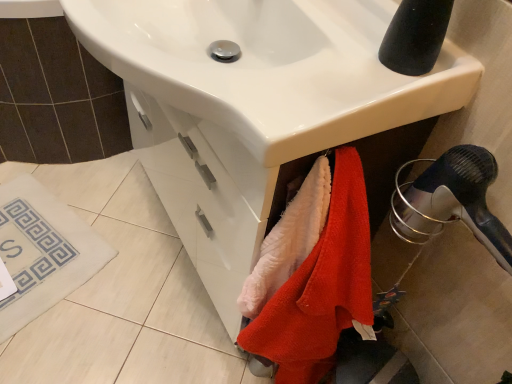
What do you see at coordinates (42, 252) in the screenshot?
I see `white fabric bath mat at lower left` at bounding box center [42, 252].

The width and height of the screenshot is (512, 384). What are the coordinates of `white glossy sink at center` in the screenshot? It's located at (272, 68).

What do you see at coordinates (323, 285) in the screenshot? I see `fluffy orange towel at lower right, which is the 2th beach towel from top to bottom` at bounding box center [323, 285].

Locate an element on the screen. This screenshot has height=384, width=512. fluffy pink towel at lower center, acting as the second beach towel starting from the bottom is located at coordinates (289, 240).

The image size is (512, 384). I want to click on white fabric bath mat at lower left, so click(x=42, y=252).

Is fluffy orange towel at lower right, which is the 2th beach towel from top to bottom, aimed at white glossy sink at center?

No, fluffy orange towel at lower right, which is the 2th beach towel from top to bottom, is not aimed at white glossy sink at center.

In the scene shown: Is fluffy orange towel at lower right, which is the 2th beach towel from top to bottom, in contact with white glossy sink at center?

They are not placed beside each other.

Which object is further away from the camera, fluffy orange towel at lower right, which is the 1th beach towel in bottom-to-top order, or white glossy sink at center?

fluffy orange towel at lower right, which is the 1th beach towel in bottom-to-top order, is behind.

Between fluffy orange towel at lower right, which is the 2th beach towel from top to bottom, and white glossy sink at center, which one has less height?

With less height is white glossy sink at center.

Which point is more forward, (354, 8) or (300, 241)?

The point (300, 241) is more forward.

Is white glossy sink at center looking in the opposite direction of fluffy pink towel at lower center, which is the first beach towel in top-to-bottom order?

No.

How much distance is there between white glossy sink at center and fluffy pink towel at lower center, which is the first beach towel in top-to-bottom order?

white glossy sink at center and fluffy pink towel at lower center, which is the first beach towel in top-to-bottom order, are 10.71 inches apart.

From a real-world perspective, is white glossy sink at center physically located above or below fluffy pink towel at lower center, which is the first beach towel in top-to-bottom order?

white glossy sink at center is situated higher than fluffy pink towel at lower center, which is the first beach towel in top-to-bottom order, in the real world.

Considering the relative positions of fluffy orange towel at lower right, which is the 1th beach towel in bottom-to-top order, and white fabric bath mat at lower left in the image provided, is fluffy orange towel at lower right, which is the 1th beach towel in bottom-to-top order, to the left of white fabric bath mat at lower left from the viewer's perspective?

No.

Who is smaller, fluffy orange towel at lower right, which is the 2th beach towel from top to bottom, or white fabric bath mat at lower left?

With smaller size is fluffy orange towel at lower right, which is the 2th beach towel from top to bottom.

How different are the orientations of fluffy orange towel at lower right, which is the 2th beach towel from top to bottom, and white fabric bath mat at lower left in degrees?

The angular difference between fluffy orange towel at lower right, which is the 2th beach towel from top to bottom, and white fabric bath mat at lower left is 21 degrees.

In terms of width, does fluffy orange towel at lower right, which is the 1th beach towel in bottom-to-top order, look wider or thinner when compared to white fabric bath mat at lower left?

fluffy orange towel at lower right, which is the 1th beach towel in bottom-to-top order, is thinner than white fabric bath mat at lower left.

Based on the photo, looking at their sizes, would you say white fabric bath mat at lower left is wider or thinner than white glossy sink at center?

Clearly, white fabric bath mat at lower left has less width compared to white glossy sink at center.

Which of these two, white fabric bath mat at lower left or white glossy sink at center, is bigger?

With larger size is white glossy sink at center.

Could you tell me if white fabric bath mat at lower left is turned towards white glossy sink at center?

No, white fabric bath mat at lower left is not facing towards white glossy sink at center.

From the image's perspective, would you say fluffy pink towel at lower center, acting as the second beach towel starting from the bottom, is shown under white glossy sink at center?

Yes, from the image's perspective, fluffy pink towel at lower center, acting as the second beach towel starting from the bottom, is beneath white glossy sink at center.

Considering the sizes of objects fluffy pink towel at lower center, acting as the second beach towel starting from the bottom, and white glossy sink at center in the image provided, who is bigger, fluffy pink towel at lower center, acting as the second beach towel starting from the bottom, or white glossy sink at center?

white glossy sink at center.

From a real-world perspective, which object rests below the other?

fluffy pink towel at lower center, acting as the second beach towel starting from the bottom.

How many degrees apart are the facing directions of fluffy pink towel at lower center, acting as the second beach towel starting from the bottom, and white glossy sink at center?

They differ by 90 degrees in their facing directions.

Considering the sizes of black rubber tap at upper right and fluffy pink towel at lower center, acting as the second beach towel starting from the bottom, in the image, is black rubber tap at upper right wider or thinner than fluffy pink towel at lower center, acting as the second beach towel starting from the bottom,?

Clearly, black rubber tap at upper right has more width compared to fluffy pink towel at lower center, acting as the second beach towel starting from the bottom.

From the picture: Would you say black rubber tap at upper right is outside fluffy pink towel at lower center, acting as the second beach towel starting from the bottom?

Yes.

Between black rubber tap at upper right and fluffy pink towel at lower center, acting as the second beach towel starting from the bottom, which one appears on the left side from the viewer's perspective?

fluffy pink towel at lower center, acting as the second beach towel starting from the bottom.

Between black rubber tap at upper right and fluffy pink towel at lower center, acting as the second beach towel starting from the bottom, which one has larger size?

black rubber tap at upper right is bigger.

Looking at this image, does white fabric bath mat at lower left have a lesser width compared to black rubber tap at upper right?

No.

From the image's perspective, does white fabric bath mat at lower left appear higher than black rubber tap at upper right?

No, from the image's perspective, white fabric bath mat at lower left is not on top of black rubber tap at upper right.

Where is `tap that is on the right side of white fabric bath mat at lower left`? Image resolution: width=512 pixels, height=384 pixels. tap that is on the right side of white fabric bath mat at lower left is located at coordinates (415, 36).

From the picture: Is white fabric bath mat at lower left not within black rubber tap at upper right?

Yes, white fabric bath mat at lower left is located beyond the bounds of black rubber tap at upper right.

You are a GUI agent. You are given a task and a screenshot of the screen. Output one action in this format:
    pyautogui.click(x=<x>, y=<y>)
    Task: Click on the sink to the left of fluffy orange towel at lower right, which is the 2th beach towel from top to bottom
    
    Given the screenshot: What is the action you would take?
    pyautogui.click(x=272, y=68)

This screenshot has height=384, width=512. I want to click on the 1st beach towel to the right of the white glossy sink at center, counting from the anchor's position, so click(x=289, y=240).

When comparing their distances from black rubber tap at upper right, does white fabric bath mat at lower left or black plastic hair dryer at lower right seem further?

Among the two, white fabric bath mat at lower left is located further to black rubber tap at upper right.

Considering their positions, is black plastic hair dryer at lower right positioned further to white fabric bath mat at lower left than fluffy orange towel at lower right, which is the 1th beach towel in bottom-to-top order?

black plastic hair dryer at lower right is further to white fabric bath mat at lower left.

Based on their spatial positions, is white fabric bath mat at lower left or fluffy orange towel at lower right, which is the 1th beach towel in bottom-to-top order, closer to white glossy sink at center?

Among the two, fluffy orange towel at lower right, which is the 1th beach towel in bottom-to-top order, is located nearer to white glossy sink at center.

From the image, which object appears to be nearer to black plastic hair dryer at lower right, white fabric bath mat at lower left or fluffy pink towel at lower center, acting as the second beach towel starting from the bottom?

fluffy pink towel at lower center, acting as the second beach towel starting from the bottom, is closer to black plastic hair dryer at lower right.

Based on their spatial positions, is fluffy pink towel at lower center, which is the first beach towel in top-to-bottom order, or white glossy sink at center closer to black plastic hair dryer at lower right?

Among the two, fluffy pink towel at lower center, which is the first beach towel in top-to-bottom order, is located nearer to black plastic hair dryer at lower right.

Looking at this image, estimate the real-world distances between objects in this image. Which object is further from black plastic hair dryer at lower right, black rubber tap at upper right or fluffy orange towel at lower right, which is the 2th beach towel from top to bottom?

black rubber tap at upper right lies further to black plastic hair dryer at lower right than the other object.

Estimate the real-world distances between objects in this image. Which object is closer to black rubber tap at upper right, white glossy sink at center or fluffy pink towel at lower center, acting as the second beach towel starting from the bottom?

Based on the image, white glossy sink at center appears to be nearer to black rubber tap at upper right.

Based on their spatial positions, is black plastic hair dryer at lower right or white glossy sink at center further from fluffy orange towel at lower right, which is the 1th beach towel in bottom-to-top order?

Based on the image, white glossy sink at center appears to be further to fluffy orange towel at lower right, which is the 1th beach towel in bottom-to-top order.

This screenshot has height=384, width=512. In order to click on sink between white fabric bath mat at lower left and black rubber tap at upper right in this screenshot , I will do `click(272, 68)`.

What are the coordinates of `hair drier between white glossy sink at center and fluffy orange towel at lower right, which is the 2th beach towel from top to bottom, in the up-down direction` in the screenshot? It's located at (452, 201).

Find the location of a particular element. The width and height of the screenshot is (512, 384). beach towel between white fabric bath mat at lower left and fluffy orange towel at lower right, which is the 2th beach towel from top to bottom, in the horizontal direction is located at coordinates (289, 240).

Where is `tap between white glossy sink at center and fluffy pink towel at lower center, which is the first beach towel in top-to-bottom order, in the vertical direction`? The image size is (512, 384). tap between white glossy sink at center and fluffy pink towel at lower center, which is the first beach towel in top-to-bottom order, in the vertical direction is located at coordinates (415, 36).